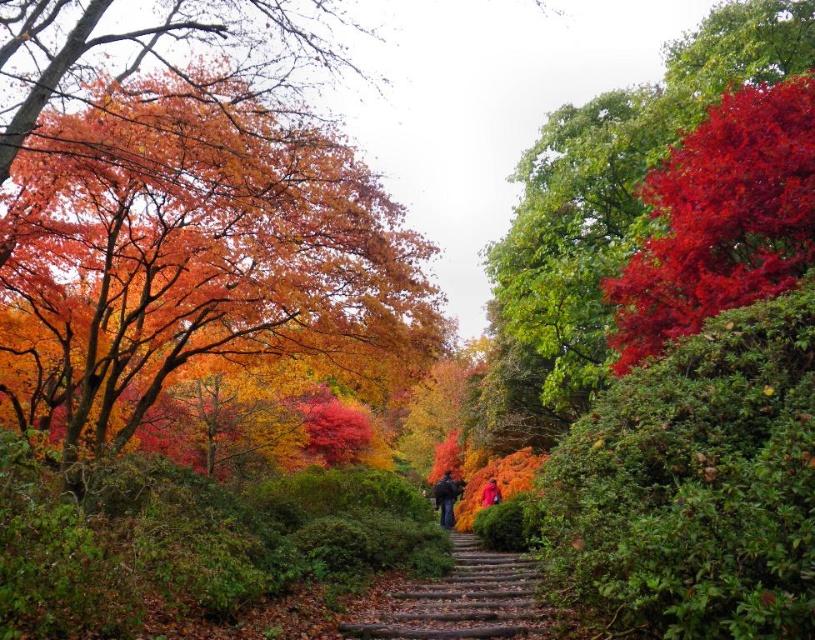
You are planning to take a photo of the brown wooden stairs at center and want to include the vivid orange leaves at left in the frame. Based on their positions, will you need to angle your camera upwards or downwards to capture both in the same shot?

The vivid orange leaves at left is above the brown wooden stairs at center, so you will need to angle your camera downwards to capture both in the same shot.

You are standing at the bottom of the brown wooden stairs at center and want to pick up the vivid orange leaves at left. In which direction should you move to reach them?

The vivid orange leaves at left are positioned on the left side of the brown wooden stairs at center. To reach them, you should move to the left from the stairs.